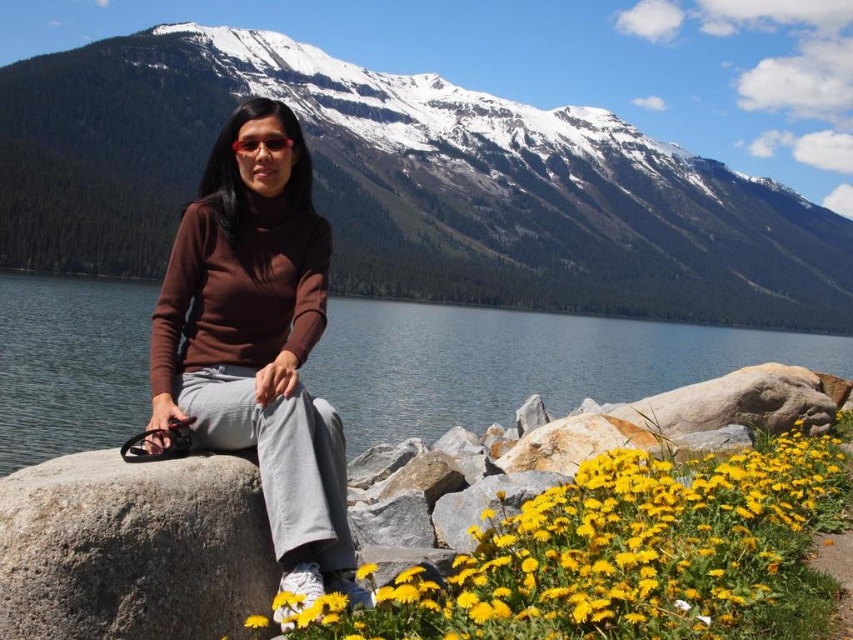
Does matte brown sweater at center have a greater width compared to brown matte sweater at center?

Indeed, matte brown sweater at center has a greater width compared to brown matte sweater at center.

Between matte brown sweater at center and brown matte sweater at center, which one has less height?

Standing shorter between the two is matte brown sweater at center.

Is point (62, 428) farther from camera compared to point (265, 374)?

Yes.

Identify the location of matte brown sweater at center. (518, 364).

Based on the photo, can you confirm if matte brown sweater at center is bigger than gray rough boulder at lower left?

Yes.

Between matte brown sweater at center and gray rough boulder at lower left, which one appears on the right side from the viewer's perspective?

From the viewer's perspective, matte brown sweater at center appears more on the right side.

Who is more forward, (476, 321) or (183, 554)?

Point (183, 554) is in front.

Identify the location of matte brown sweater at center. (518, 364).

Can you confirm if yellow matte flower at lower right is positioned above gray rough boulder at lower left?

No, yellow matte flower at lower right is not above gray rough boulder at lower left.

Does yellow matte flower at lower right have a lesser width compared to gray rough boulder at lower left?

No, yellow matte flower at lower right is not thinner than gray rough boulder at lower left.

Where is `yellow matte flower at lower right`? The height and width of the screenshot is (640, 853). yellow matte flower at lower right is located at coordinates (634, 556).